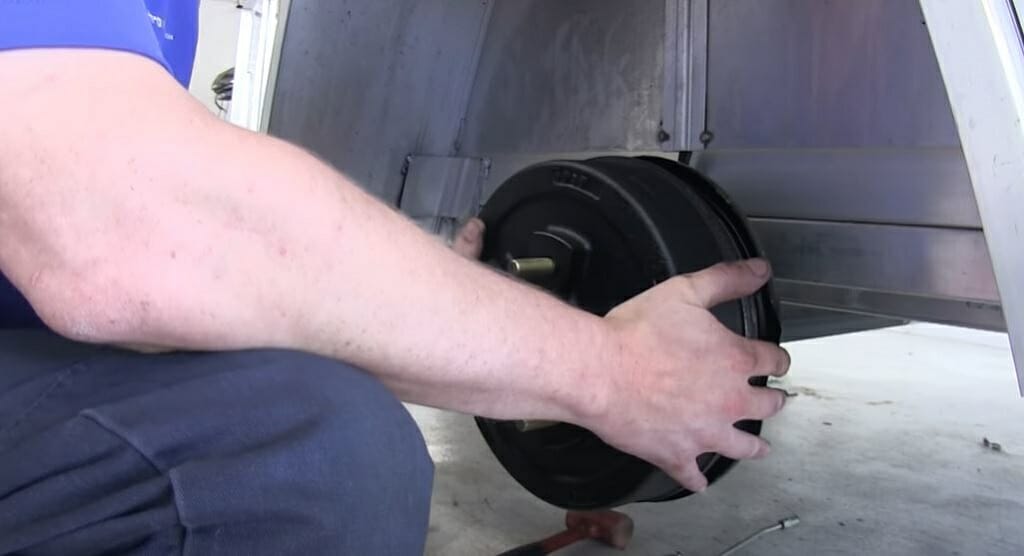
In order to click on concrete floor in this screenshot , I will do `click(882, 449)`, `click(477, 499)`, `click(878, 357)`.